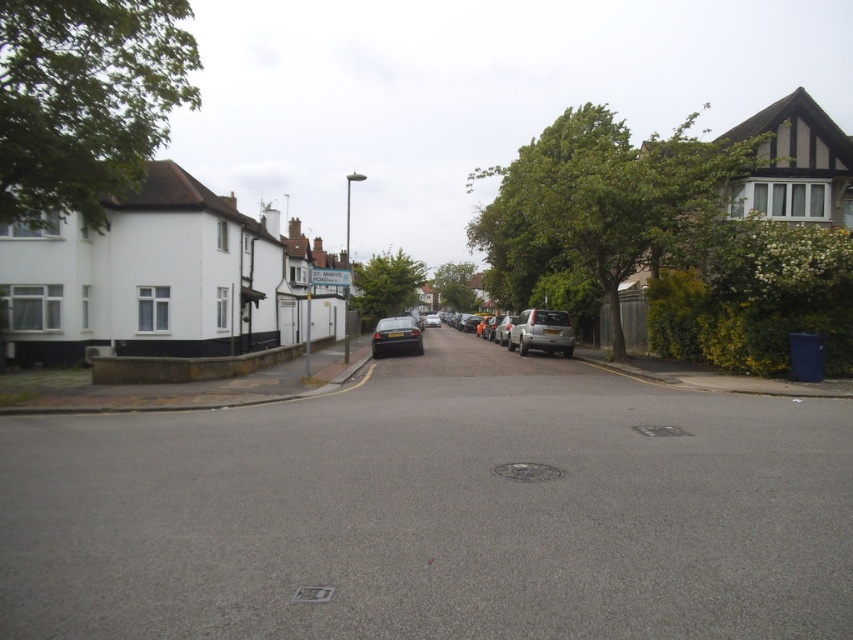
You are a delivery person trying to park your delivery van, which is 6 meters long, in the residential street. You see the satin silver car at center and the satin black car at center. Can you fit your van between them?

The satin silver car at center is larger in size than the satin black car at center. However, without knowing the exact distance between them, it is impossible to determine if the van will fit. Please check the available space between the two cars first.

You are a delivery person trying to park your delivery van, which is 2 meters tall, in this residential area. You see the satin silver car at center and the satin black car at center. Can you determine if your van can fit between them?

The satin silver car at center is taller than the satin black car at center. However, since the height of the tallest car is not provided, it is impossible to determine if the van can fit between them.

You are a delivery person trying to park your van between the satin silver car at center and the satin black car at center. The van is 2 meters wide. Can you fit your van between them?

The satin silver car at center is to the right of the satin black car at center, but the distance between them isn not provided in the objects description. Without knowing the exact spacing, it is impossible to determine if the van can fit.